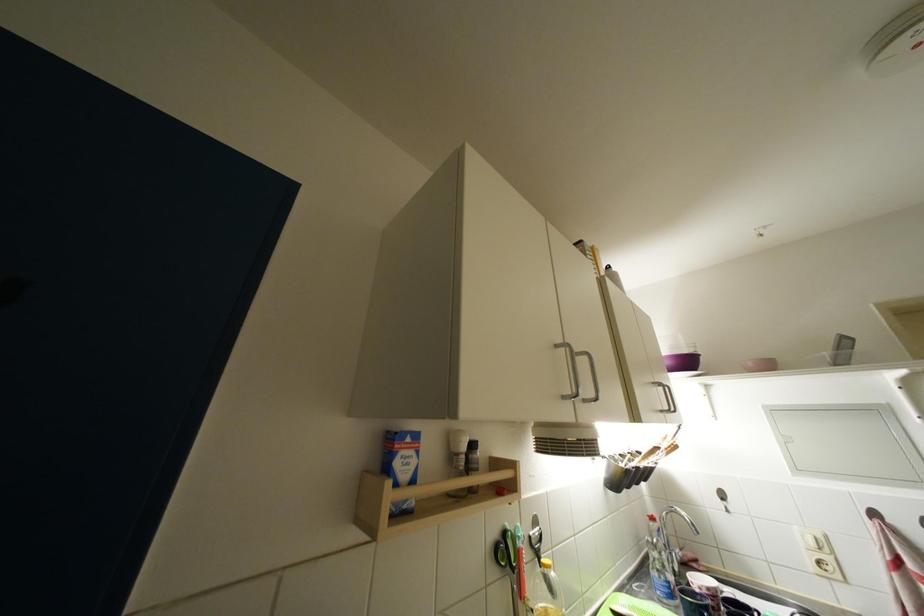
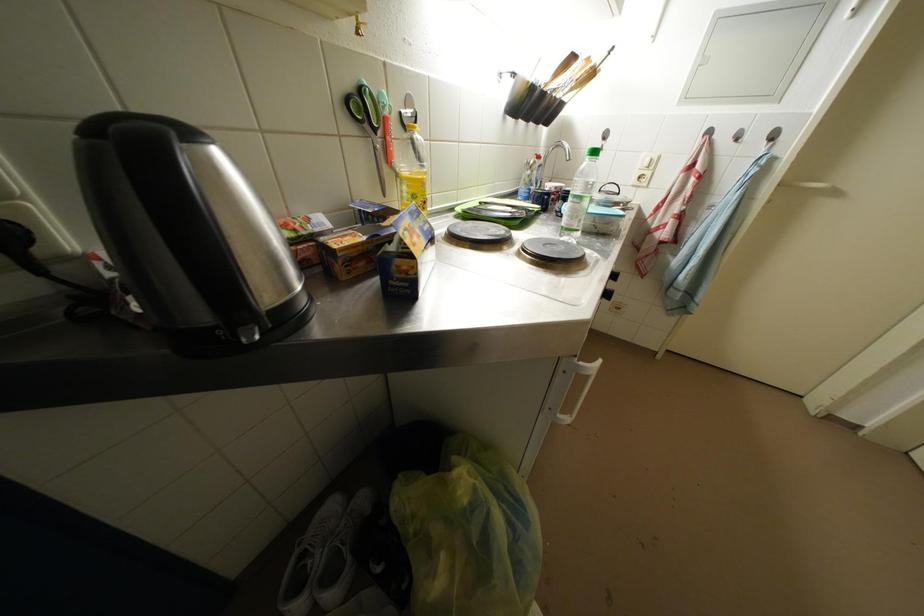
The first image is from the beginning of the video and the second image is from the end. How did the camera likely rotate when shooting the video?

The camera's rotation is toward right-down.